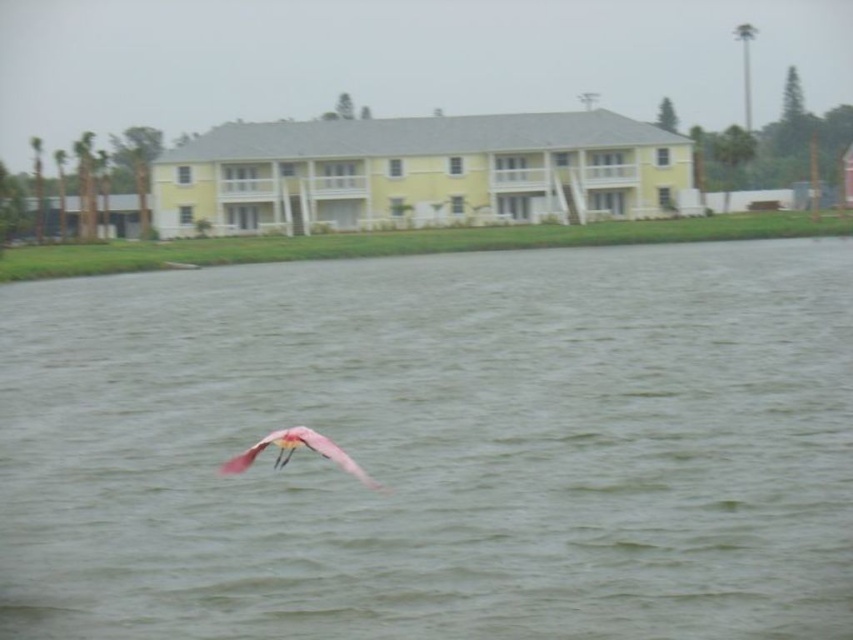
Question: Can you confirm if green water at center is thinner than pink feathered bird at center?

Choices:
 (A) no
 (B) yes

Answer: (A)

Question: Which object is farther from the camera taking this photo?

Choices:
 (A) pink feathered bird at center
 (B) green water at center

Answer: (B)

Question: Does green water at center have a larger size compared to pink feathered bird at center?

Choices:
 (A) yes
 (B) no

Answer: (A)

Question: Among these points, which one is farthest from the camera?

Choices:
 (A) (223, 416)
 (B) (317, 433)

Answer: (A)

Question: Is the position of green water at center more distant than that of pink feathered bird at center?

Choices:
 (A) no
 (B) yes

Answer: (B)